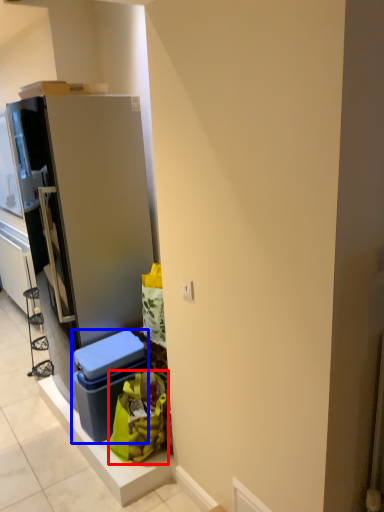
Question: Which object is closer to the camera taking this photo, garbage (highlighted by a red box) or storage box (highlighted by a blue box)?

Choices:
 (A) garbage
 (B) storage box

Answer: (A)